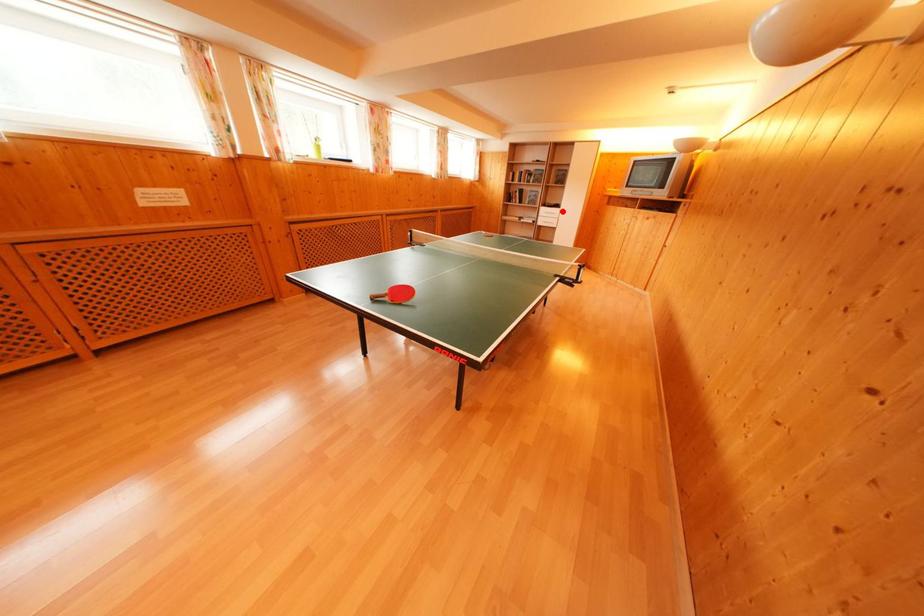
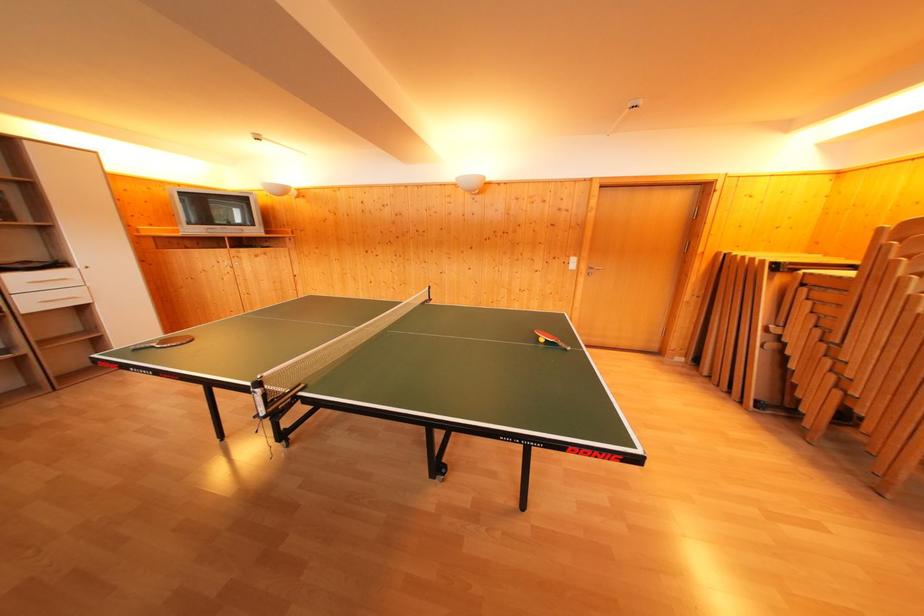
Where in the second image is the point corresponding to the highlighted location from the first image?

(64, 270)